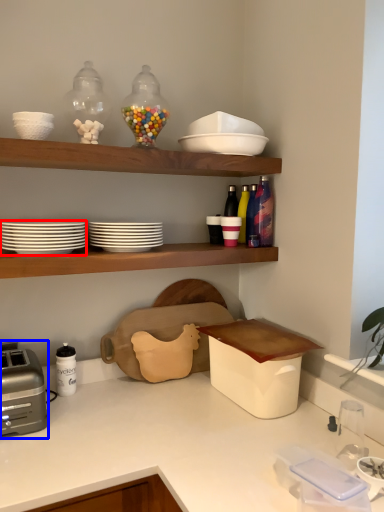
Question: Which object appears farthest to the camera in this image, tableware (highlighted by a red box) or toaster (highlighted by a blue box)?

Choices:
 (A) tableware
 (B) toaster

Answer: (B)